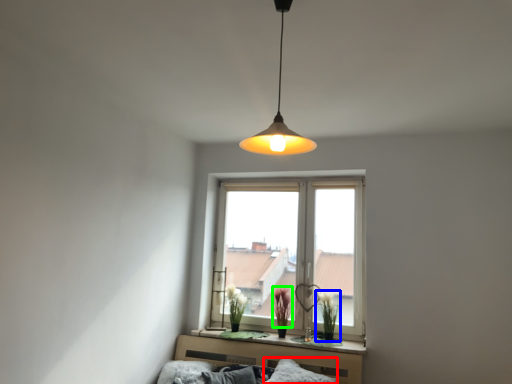
Question: Which object is positioned closest to pillow (highlighted by a red box)? Select from plant (highlighted by a blue box) and plant (highlighted by a green box).

Choices:
 (A) plant
 (B) plant

Answer: (A)